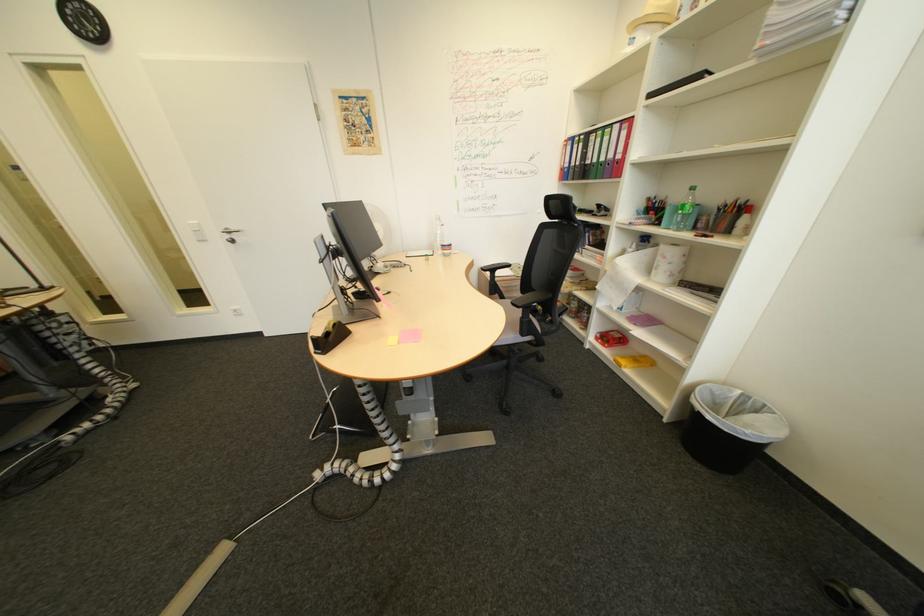
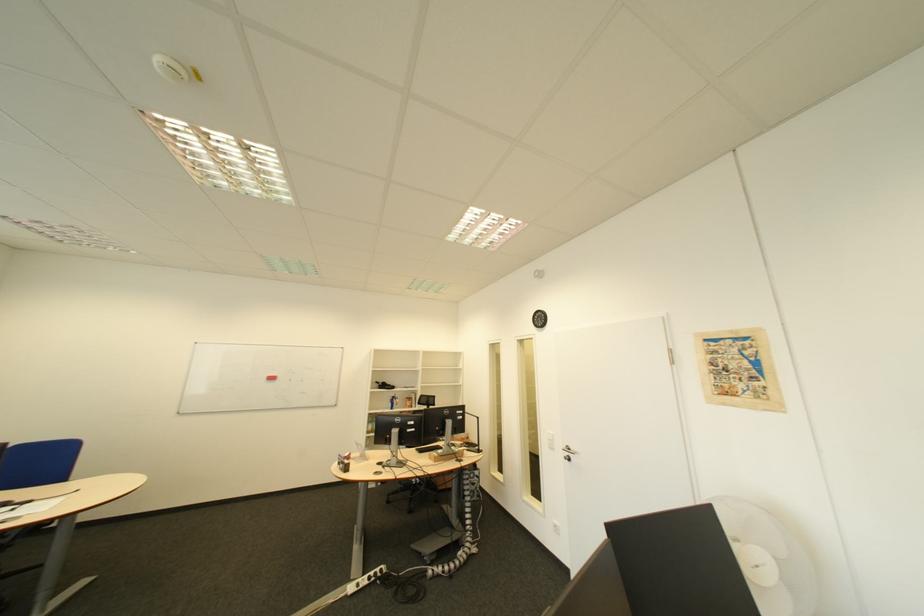
How did the camera likely rotate?

The rotation direction of the camera is left-up.